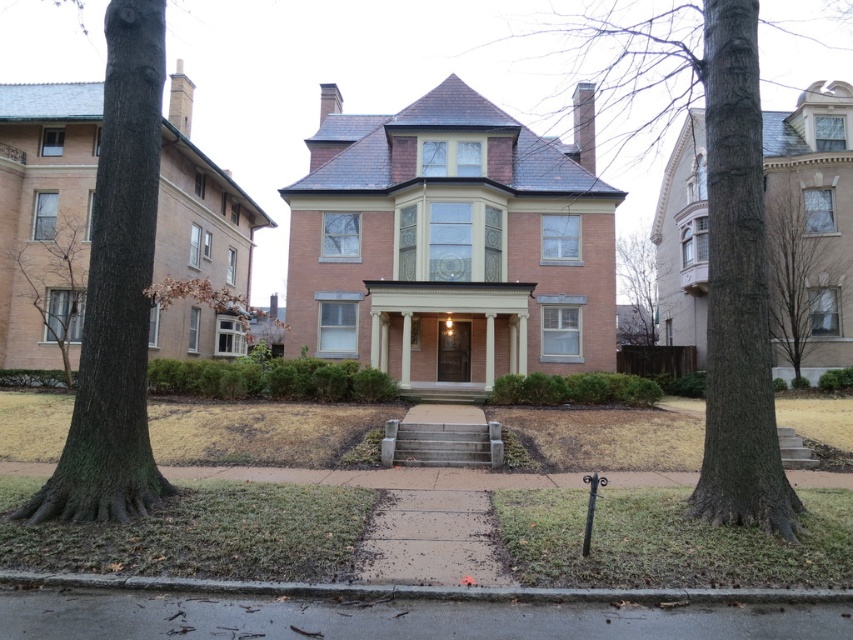
Question: Is brown textured tree at center below brown bark tree at right?

Choices:
 (A) no
 (B) yes

Answer: (A)

Question: Among these objects, which one is farthest from the camera?

Choices:
 (A) green rough bark tree at left
 (B) green leafy tree at right
 (C) brown bark tree at right

Answer: (B)

Question: Which object is closer to the camera taking this photo?

Choices:
 (A) brown textured tree at center
 (B) green leafy tree at right

Answer: (A)

Question: Among these points, which one is farthest from the camera?

Choices:
 (A) (68, 218)
 (B) (682, 61)

Answer: (B)

Question: Can you confirm if brown bark tree at left is thinner than green leafy tree at right?

Choices:
 (A) no
 (B) yes

Answer: (B)

Question: Is brown bark tree at right thinner than green leafy tree at right?

Choices:
 (A) no
 (B) yes

Answer: (B)